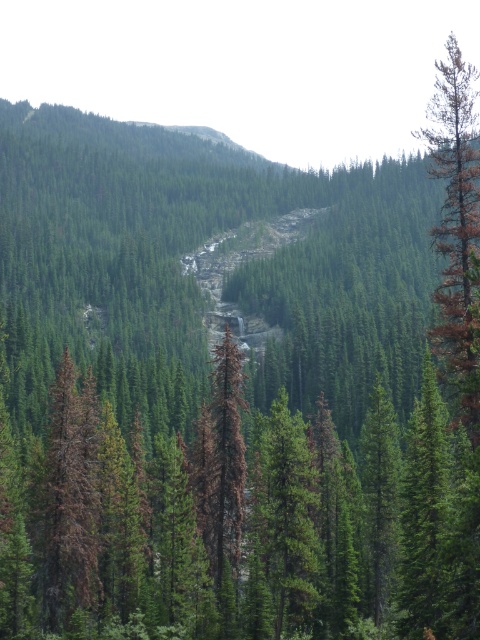
You are standing in the forested valley and want to reach the waterfall. You see two points marked on your map. The first point is at coordinate point (454,316) and the second is at coordinate point (84,492). Which point is closer to you if you are facing the waterfall?

Point (454,316) is in front of point (84,492), so if you are facing the waterfall, point (454,316) is closer to you.